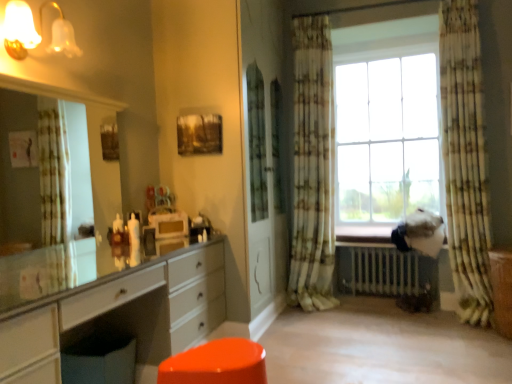
The height and width of the screenshot is (384, 512). In order to click on vacant area that lies in front of floral fabric curtain at right, the first curtain viewed from the right in this screenshot , I will do `click(470, 338)`.